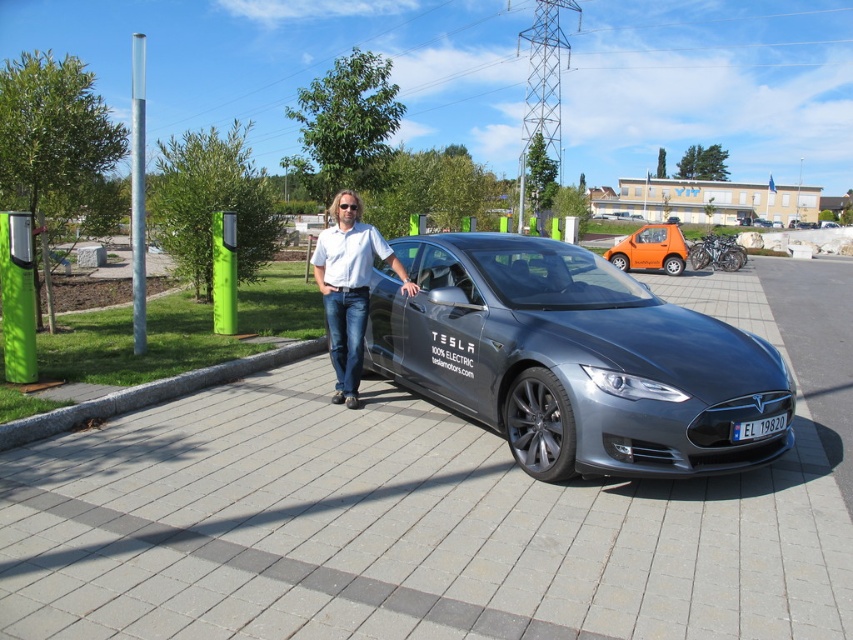
Based on the photo, can you confirm if sleek metallic tesla at center is shorter than gray concrete curb at lower left?

No.

Is point (579, 260) positioned after point (61, 412)?

Yes.

At what (x,y) coordinates should I click in order to perform the action: click on sleek metallic tesla at center. Please return your answer as a coordinate pair (x, y). Looking at the image, I should click on (573, 358).

Is silver metallic pole at upper left bigger than orange matte car at center?

Correct, silver metallic pole at upper left is larger in size than orange matte car at center.

Can you confirm if silver metallic pole at upper left is wider than orange matte car at center?

Indeed, silver metallic pole at upper left has a greater width compared to orange matte car at center.

Between point (137, 118) and point (665, 250), which one is positioned in front?

Point (137, 118) is more forward.

The image size is (853, 640). What are the coordinates of `silver metallic pole at upper left` in the screenshot? It's located at (137, 193).

Can you confirm if sleek metallic tesla at center is thinner than orange matte car at center?

No.

Is sleek metallic tesla at center wider than orange matte car at center?

Indeed, sleek metallic tesla at center has a greater width compared to orange matte car at center.

Which is behind, point (792, 388) or point (665, 252)?

Positioned behind is point (665, 252).

Locate an element on the screen. sleek metallic tesla at center is located at coordinates (573, 358).